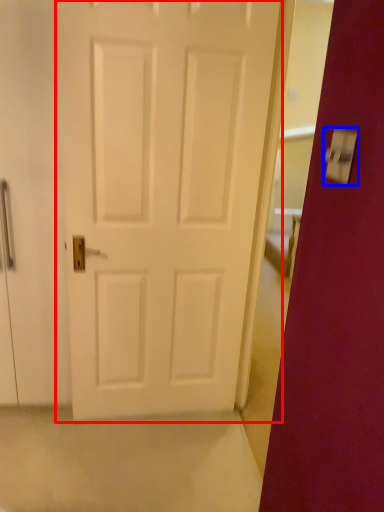
Question: Which of the following is the farthest to the observer, door (highlighted by a red box) or light switch (highlighted by a blue box)?

Choices:
 (A) door
 (B) light switch

Answer: (A)